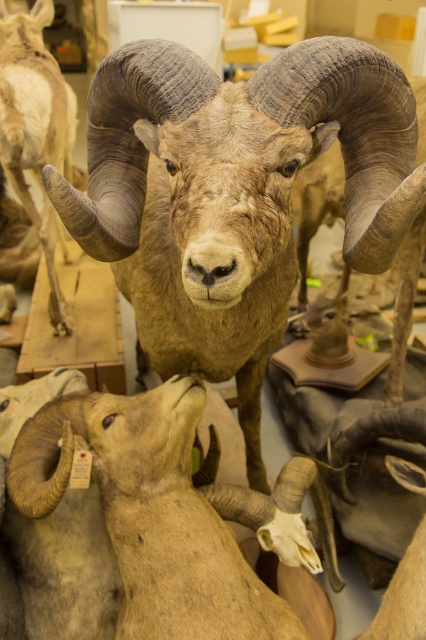
Question: Is brown textured ram at center thinner than light brown woolen sheep at lower center?

Choices:
 (A) yes
 (B) no

Answer: (A)

Question: Does brown textured ram at center have a smaller size compared to light brown woolen sheep at lower center?

Choices:
 (A) no
 (B) yes

Answer: (A)

Question: Which of the following is the closest to the observer?

Choices:
 (A) light brown woolen sheep at lower center
 (B) brown textured ram at center

Answer: (B)

Question: Is brown textured ram at center above light brown woolen sheep at lower center?

Choices:
 (A) yes
 (B) no

Answer: (A)